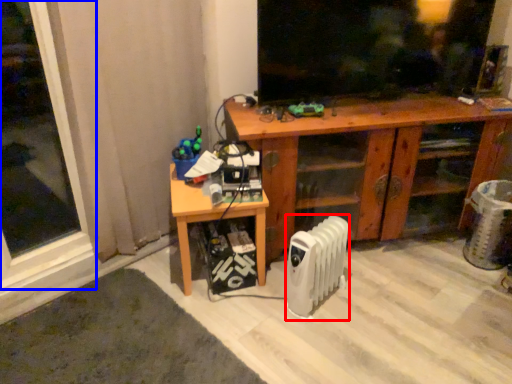
Question: Which object appears farthest to the camera in this image, radiator (highlighted by a red box) or window (highlighted by a blue box)?

Choices:
 (A) radiator
 (B) window

Answer: (A)